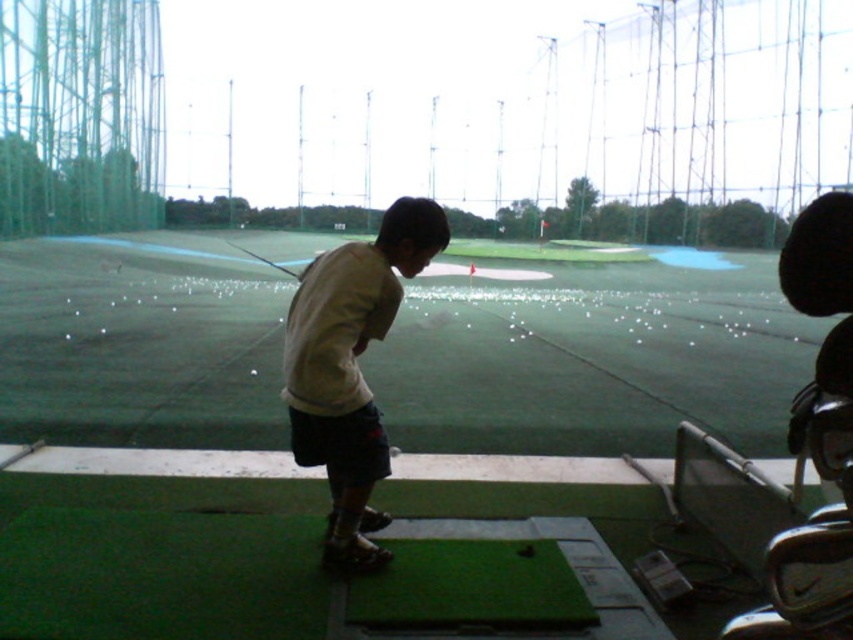
Question: Which point is closer to the camera taking this photo?

Choices:
 (A) (665, 369)
 (B) (360, 250)

Answer: (B)

Question: Which of the following is the closest to the observer?

Choices:
 (A) (309, 400)
 (B) (112, 385)

Answer: (A)

Question: Is green artificial turf at center below metallic silver golf club at center?

Choices:
 (A) yes
 (B) no

Answer: (A)

Question: Is green artificial turf at center to the right of metallic silver golf club at center from the viewer's perspective?

Choices:
 (A) yes
 (B) no

Answer: (A)

Question: Does green artificial turf at center come behind light beige shirt at center?

Choices:
 (A) yes
 (B) no

Answer: (A)

Question: Which point is farther to the camera?

Choices:
 (A) light beige shirt at center
 (B) green artificial turf at center

Answer: (B)